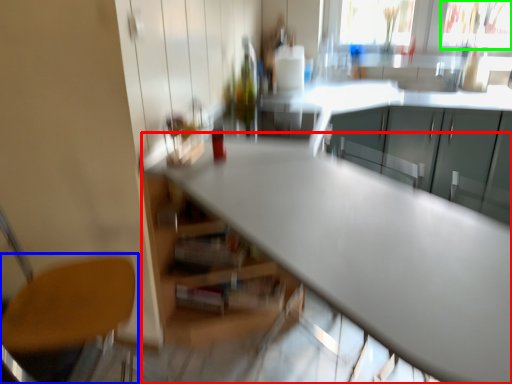
Question: Which is nearer to the table (highlighted by a red box)? chair (highlighted by a blue box) or window screen (highlighted by a green box).

Choices:
 (A) chair
 (B) window screen

Answer: (A)